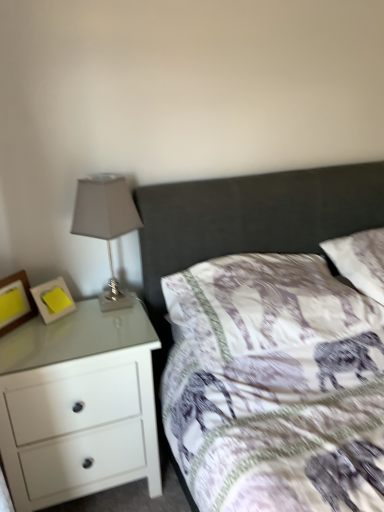
What are the coordinates of `vacant space that's between wooden picture frame at left, marked as the first picture frame in a left-to-right arrangement, and yellow paper at left, marked as the 1th picture frame in a right-to-left arrangement` in the screenshot? It's located at (27, 329).